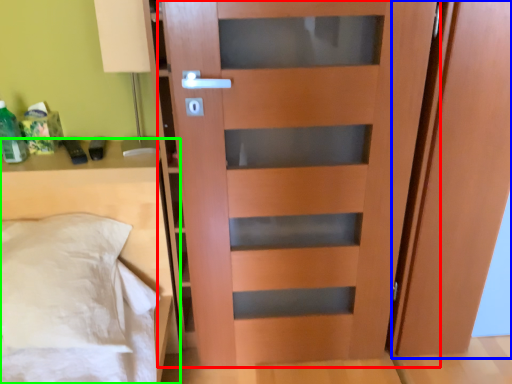
Question: Estimate the real-world distances between objects in this image. Which object is closer to door (highlighted by a red box), screen door (highlighted by a blue box) or furniture (highlighted by a green box)?

Choices:
 (A) screen door
 (B) furniture

Answer: (A)